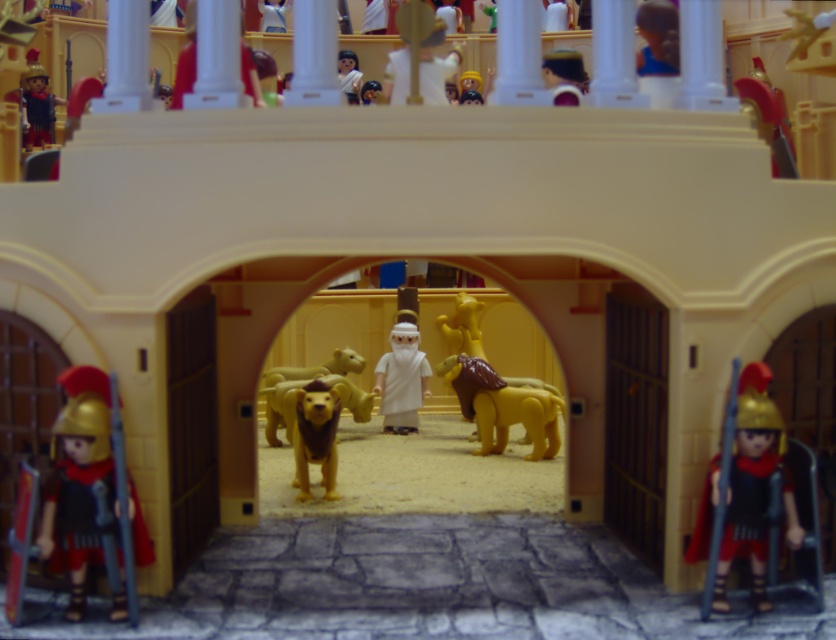
Is shiny gold helmet at left thinner than matte black helmet at upper left?

No.

Does shiny gold helmet at left appear under matte black helmet at upper left?

Yes.

Describe the element at coordinates (78, 480) in the screenshot. The width and height of the screenshot is (836, 640). I see `shiny gold helmet at left` at that location.

At what (x,y) coordinates should I click in order to perform the action: click on shiny gold helmet at left. Please return your answer as a coordinate pair (x, y). The width and height of the screenshot is (836, 640). Looking at the image, I should click on (78, 480).

Does point (340, 385) come farther from viewer compared to point (675, 54)?

That is True.

Which of these two, yellow plush lion at center or smooth blue shirt at upper center, stands taller?

yellow plush lion at center is taller.

This screenshot has width=836, height=640. I want to click on yellow plush lion at center, so click(x=279, y=408).

Can you confirm if smooth blue shirt at upper center is taller than light brown plush lion at center?

Yes.

Who is positioned more to the left, smooth blue shirt at upper center or light brown plush lion at center?

Positioned to the left is light brown plush lion at center.

In order to click on smooth blue shirt at upper center in this screenshot , I will do `click(656, 38)`.

This screenshot has width=836, height=640. I want to click on smooth blue shirt at upper center, so 656,38.